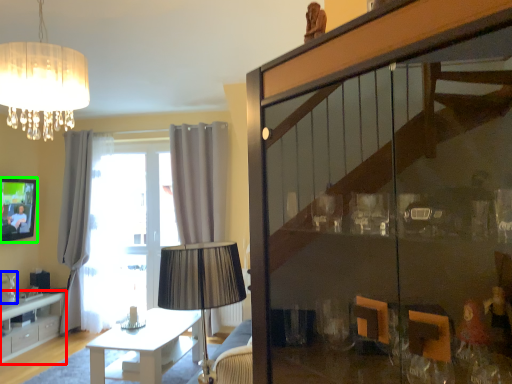
Question: Considering the real-world distances, which object is farthest from cabinetry (highlighted by a red box)? glass vase (highlighted by a blue box) or picture frame (highlighted by a green box)?

Choices:
 (A) glass vase
 (B) picture frame

Answer: (B)